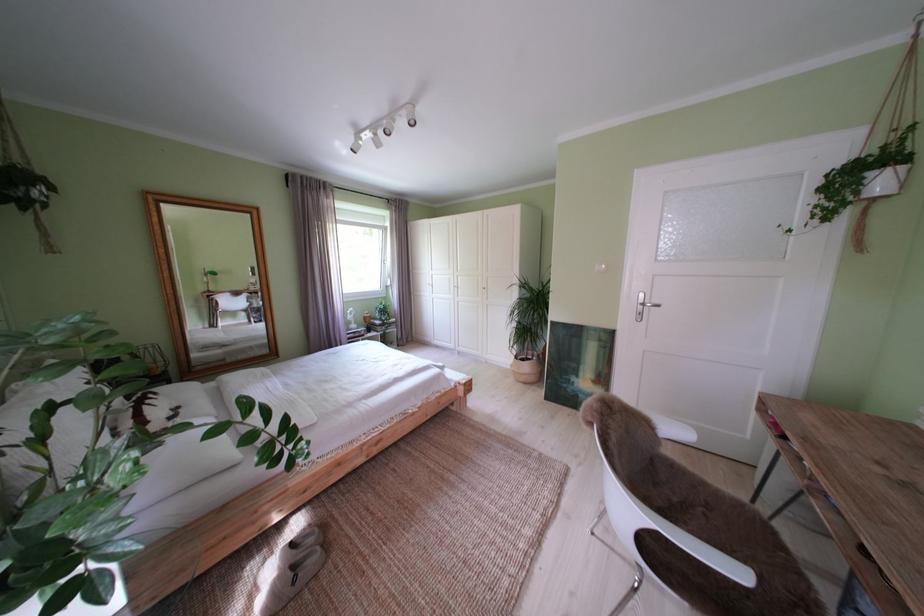
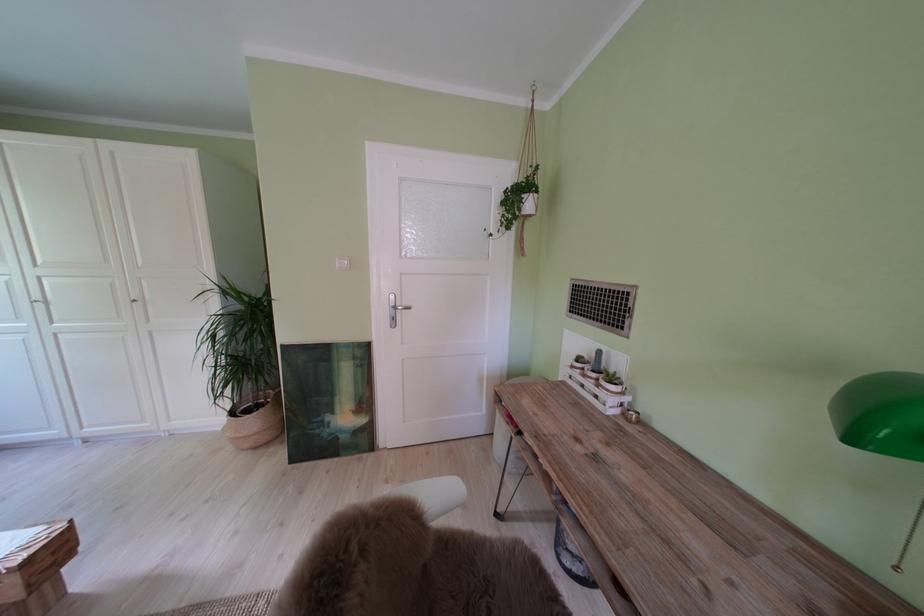
The point at (869, 198) is marked in the first image. Where is the corresponding point in the second image?

(530, 215)